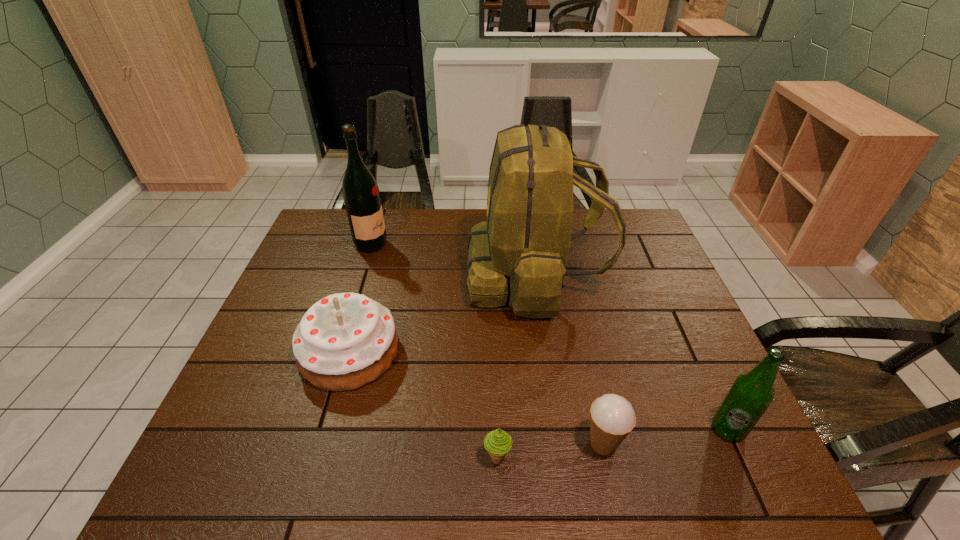
This screenshot has height=540, width=960. What are the coordinates of `backpack` in the screenshot? It's located at (521, 251).

Image resolution: width=960 pixels, height=540 pixels. I want to click on liquor, so click(361, 195).

Where is `the rightmost object`? This screenshot has width=960, height=540. the rightmost object is located at coordinates (751, 394).

Where is `the third tallest object`? This screenshot has height=540, width=960. the third tallest object is located at coordinates (751, 394).

Locate an element on the screen. cake is located at coordinates (345, 341).

Where is `the right icecream`? the right icecream is located at coordinates (612, 417).

Where is `the left icecream`? The width and height of the screenshot is (960, 540). the left icecream is located at coordinates [x=498, y=443].

I want to click on the shorter icecream, so click(498, 443).

Locate an element on the screen. free space located on the front-facing side of the backpack is located at coordinates (390, 276).

Find the location of a particular element. This screenshot has width=960, height=540. vacant space located 0.290m on the front-facing side of the backpack is located at coordinates (370, 276).